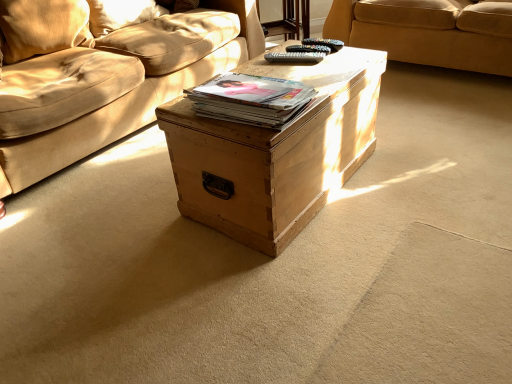
Identify the location of spots to the right of natural wood trunk at center. (422, 168).